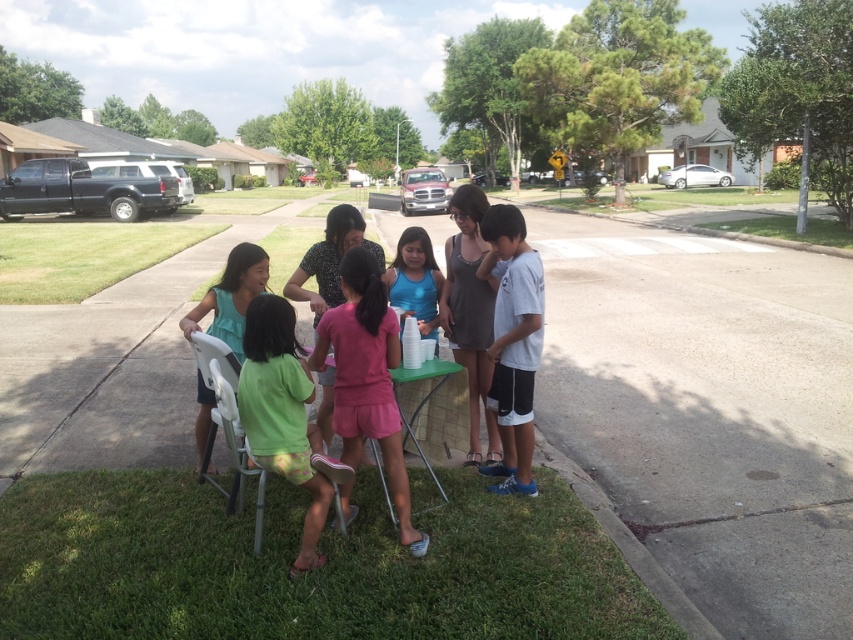
Question: Based on their relative distances, which object is farther from the gray cotton dress at center?

Choices:
 (A) green fabric shorts at lower center
 (B) white cotton shirt at right

Answer: (A)

Question: Can you confirm if gray concrete pavement at center is wider than matte blue tank top at center?

Choices:
 (A) yes
 (B) no

Answer: (A)

Question: Considering the real-world distances, which object is closest to the green fabric shorts at lower center?

Choices:
 (A) gray cotton dress at center
 (B) gray concrete pavement at center
 (C) white cotton shirt at right

Answer: (C)

Question: Which object appears closest to the camera in this image?

Choices:
 (A) green fabric shorts at lower center
 (B) matte teal shirt at center

Answer: (A)

Question: Is green fabric shorts at lower center positioned at the back of gray cotton dress at center?

Choices:
 (A) no
 (B) yes

Answer: (A)

Question: Does pink fabric shorts at center have a greater width compared to green fabric shorts at lower center?

Choices:
 (A) no
 (B) yes

Answer: (B)